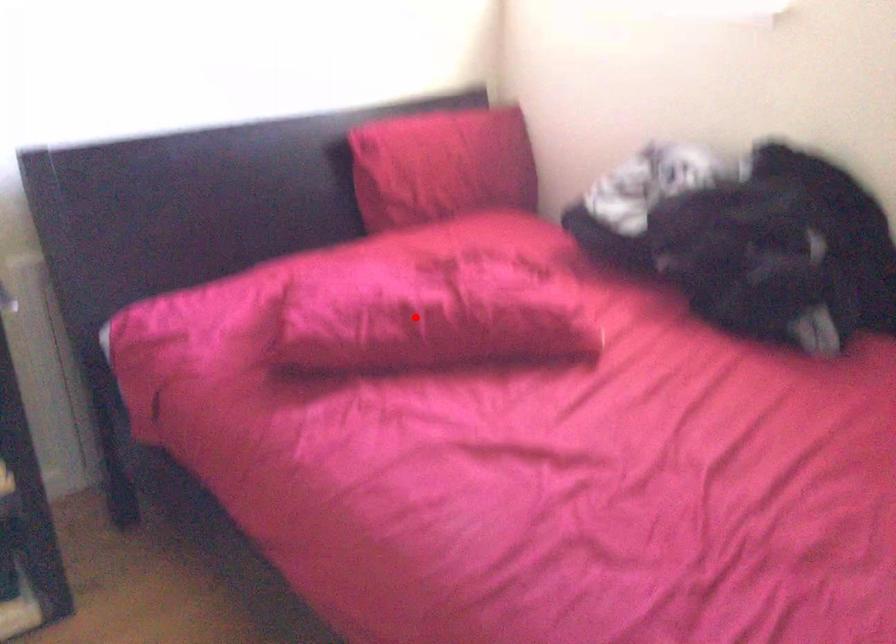
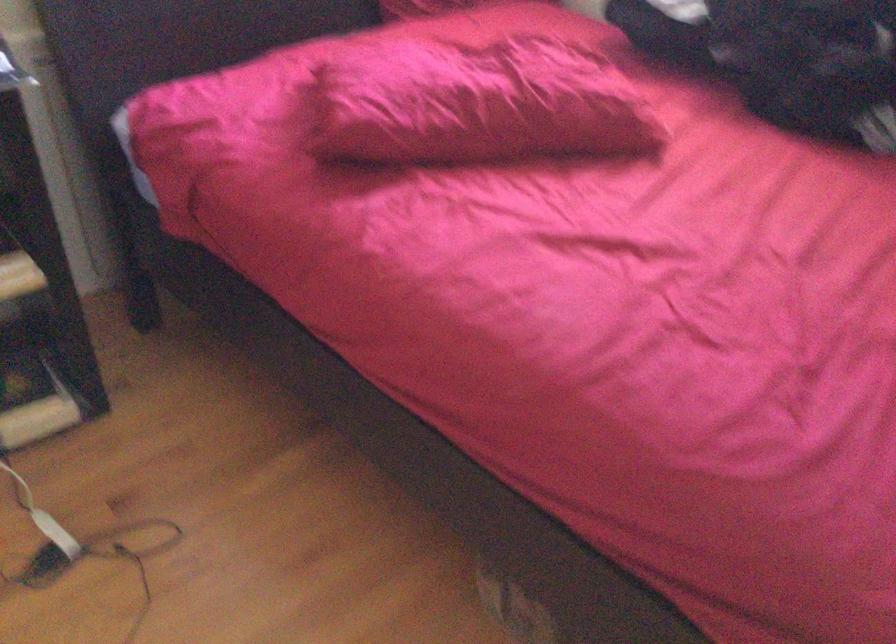
Where in the second image is the point corresponding to the highlighted location from the first image?

(477, 104)